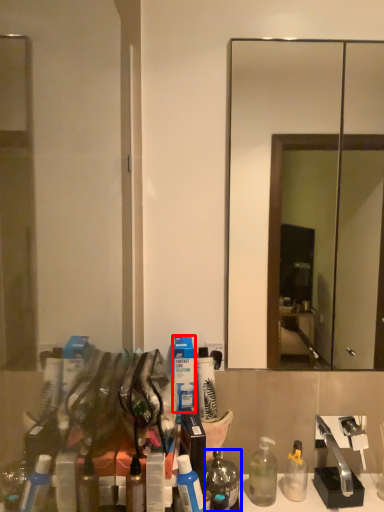
Question: Which object is further to the camera taking this photo, toiletry (highlighted by a red box) or mouthwash (highlighted by a blue box)?

Choices:
 (A) toiletry
 (B) mouthwash

Answer: (A)